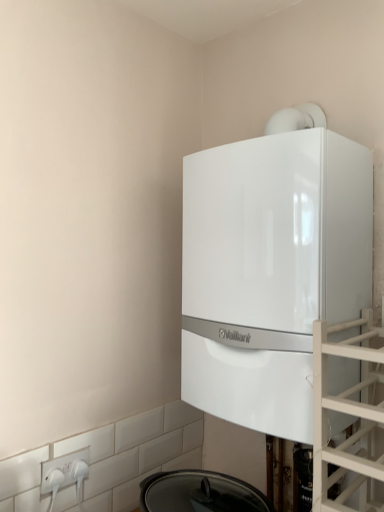
Question: From the image's perspective, is white plastic electric outlet at lower left located above or below white glossy boiler at upper center?

Choices:
 (A) above
 (B) below

Answer: (B)

Question: Is white plastic electric outlet at lower left bigger or smaller than white glossy boiler at upper center?

Choices:
 (A) big
 (B) small

Answer: (B)

Question: Which is farther from the transparent glass door at right?

Choices:
 (A) white plastic electric outlet at lower left
 (B) white glossy boiler at upper center

Answer: (A)

Question: Which of these objects is positioned closest to the transparent glass door at right?

Choices:
 (A) white plastic electric outlet at lower left
 (B) white glossy boiler at upper center

Answer: (B)